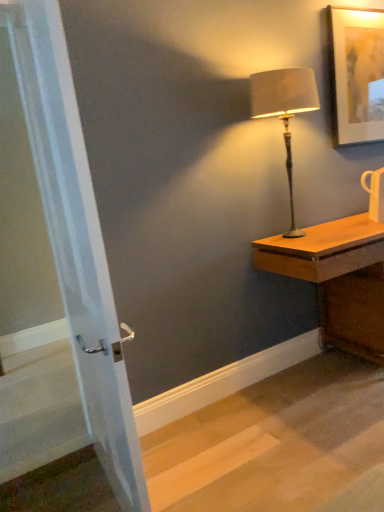
You are a GUI agent. You are given a task and a screenshot of the screen. Output one action in this format:
    pyautogui.click(x=<x>, y=<y>)
    Task: Click on the free space above matte white picture frame at upper right (from a real-world perspective)
    The height and width of the screenshot is (512, 384).
    Given the screenshot: What is the action you would take?
    pyautogui.click(x=368, y=2)